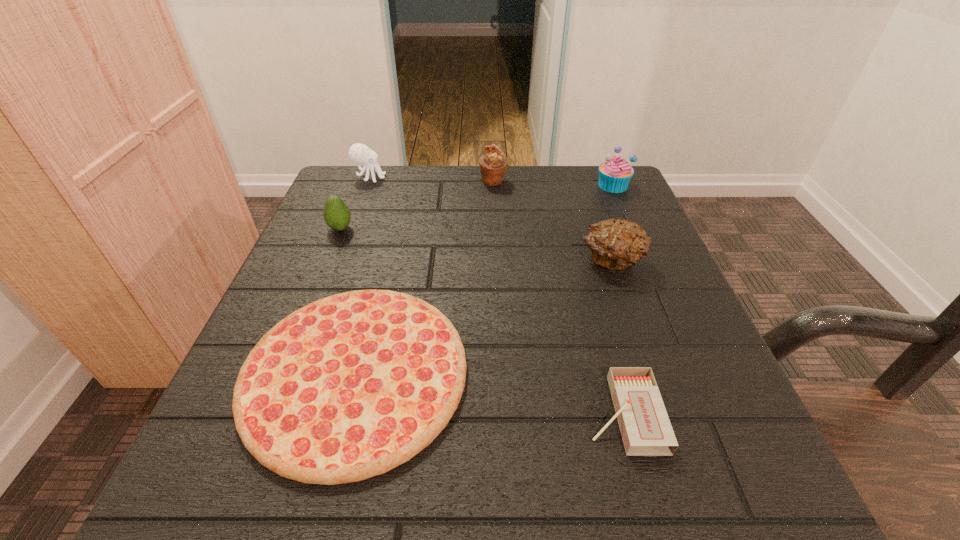
I want to click on vacant area located on the striking surface of the second shortest object, so click(469, 414).

Where is `vacant region located 0.220m on the striking surface of the second shortest object`? vacant region located 0.220m on the striking surface of the second shortest object is located at coordinates (425, 414).

The width and height of the screenshot is (960, 540). Identify the location of vacant space located on the striking surface of the second shortest object. (447, 414).

This screenshot has width=960, height=540. Identify the location of vacant region located on the back of the shortest object. (400, 195).

In order to click on octopus that is at the far edge in this screenshot , I will do `click(359, 153)`.

Image resolution: width=960 pixels, height=540 pixels. In order to click on matchbox that is at the near edge in this screenshot , I will do `click(644, 424)`.

At what (x,y) coordinates should I click in order to perform the action: click on pizza that is at the near edge. Please return your answer as a coordinate pair (x, y). This screenshot has height=540, width=960. Looking at the image, I should click on (348, 387).

Locate an element on the screen. The image size is (960, 540). octopus positioned at the left edge is located at coordinates (359, 153).

At what (x,y) coordinates should I click in order to perform the action: click on avocado present at the left edge. Please return your answer as a coordinate pair (x, y). This screenshot has height=540, width=960. Looking at the image, I should click on (337, 216).

Where is `pizza that is at the left edge`? This screenshot has width=960, height=540. pizza that is at the left edge is located at coordinates (348, 387).